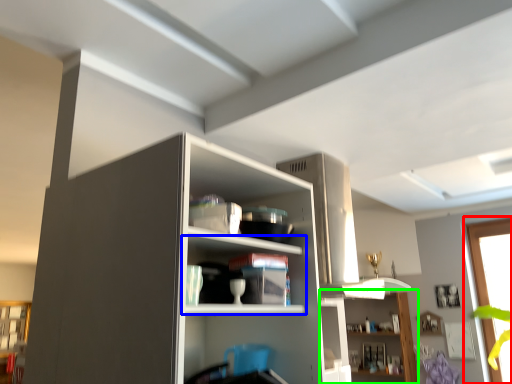
Question: Estimate the real-world distances between objects in this image. Which object is closer to window (highlighted by a red box), shelf (highlighted by a blue box) or shelf (highlighted by a green box)?

Choices:
 (A) shelf
 (B) shelf

Answer: (B)